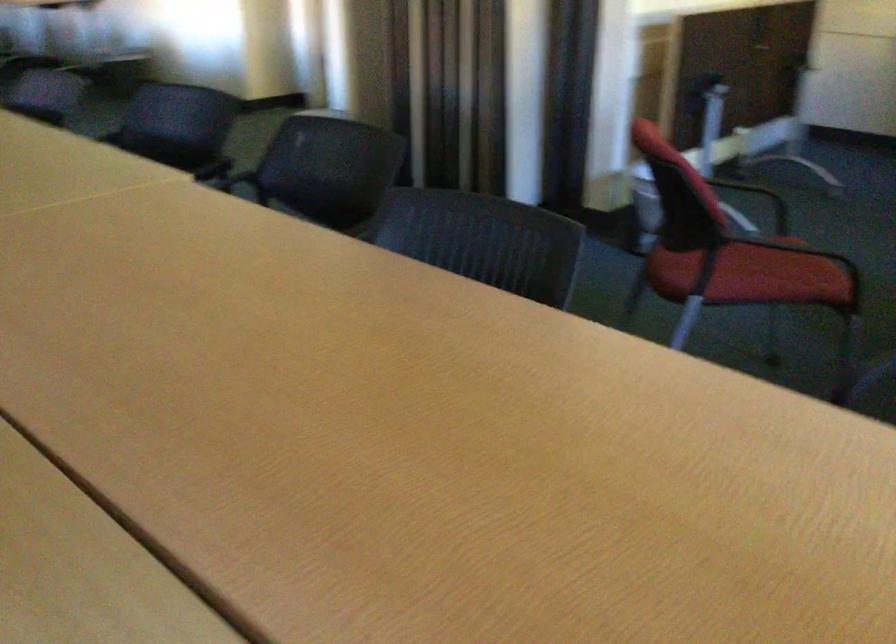
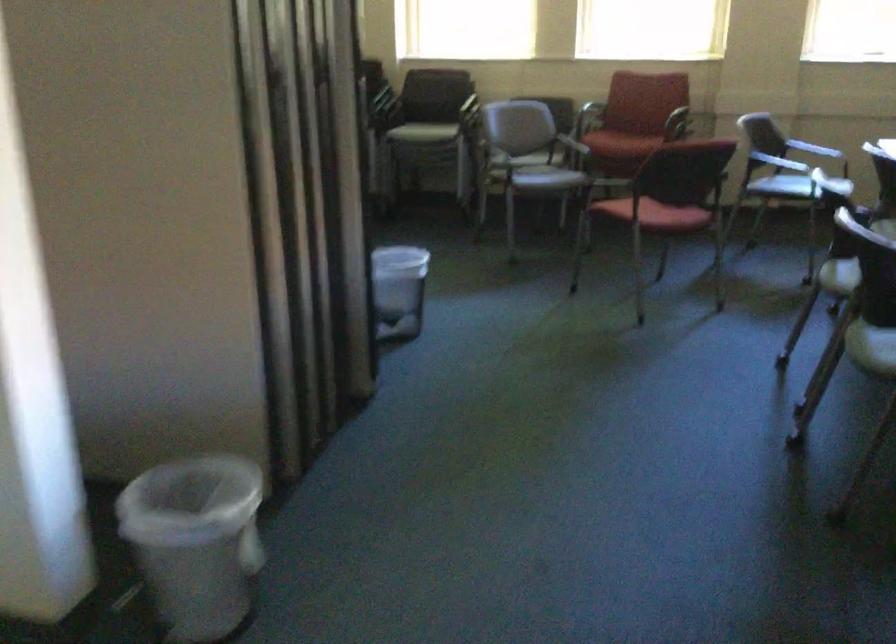
Question: I am providing you with two images of the same scene from different viewpoints. After the viewpoint changes to image2, which objects are now occluded?

Choices:
 (A) plastic trash can
 (B) red chair armrest
 (C) tissue from dispenser
 (D) red chair sitting surface

Answer: (D)